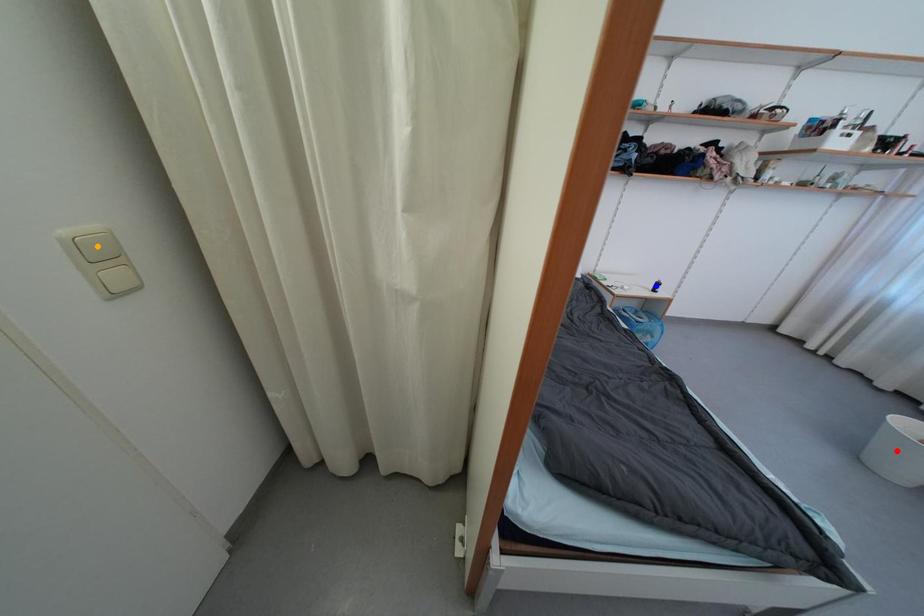
Order these from farthest to nearest:
- blue point
- orange point
- red point

blue point < red point < orange point